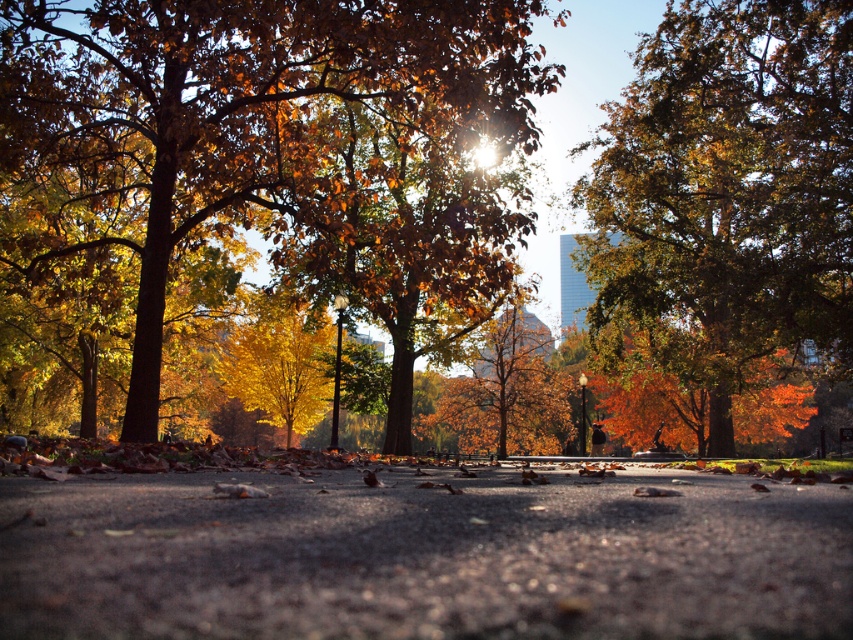
You are a photographer standing on the pathway in the autumn scene. You notice two sets of leaves at the center of the image. Which set of leaves, the golden leaves at center or the golden textured leaves at center, is closer to the camera?

The golden leaves at center is closer to the camera because it is positioned above the golden textured leaves at center, which places it in a more forward plane in the scene.

You are a photographer standing at the edge of the pathway in the autumn scene. You want to take a photo that focuses on the golden leaves at center without the golden textured tree at center being too prominent in the background. Based on their positions, is this possible?

Yes, since the golden leaves at center are in front of the golden textured tree at center, you can focus on the leaves and have the tree slightly blurred in the background by adjusting the camera focus.